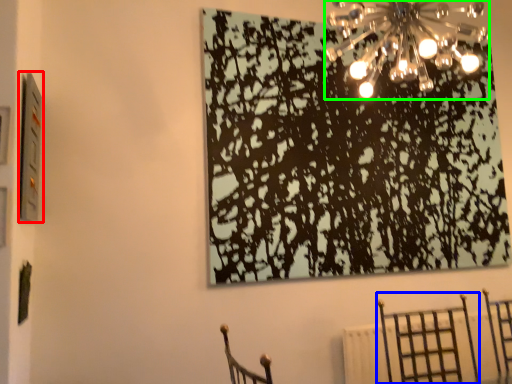
Question: Based on their relative distances, which object is nearer to picture frame (highlighted by a red box)? Choose from furniture (highlighted by a blue box) and lamp (highlighted by a green box).

Choices:
 (A) furniture
 (B) lamp

Answer: (B)